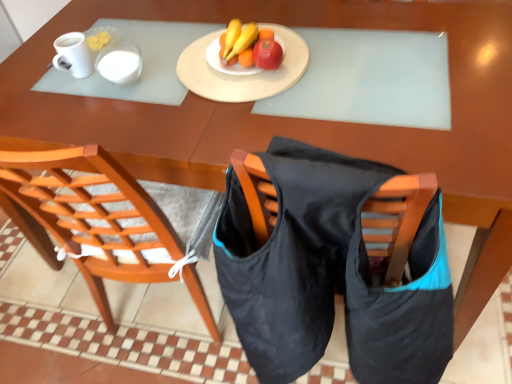
Where is `vacant space situated on the left part of white glossy mug at upper left`? Image resolution: width=512 pixels, height=384 pixels. vacant space situated on the left part of white glossy mug at upper left is located at coordinates (66, 87).